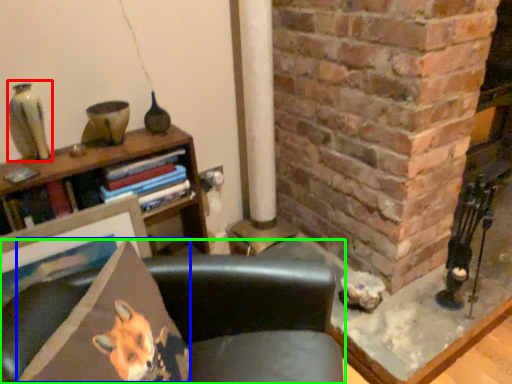
Question: Which object is the farthest from gray (highlighted by a red box)? Choose among these: throw pillow (highlighted by a blue box) or chair (highlighted by a green box).

Choices:
 (A) throw pillow
 (B) chair

Answer: (B)